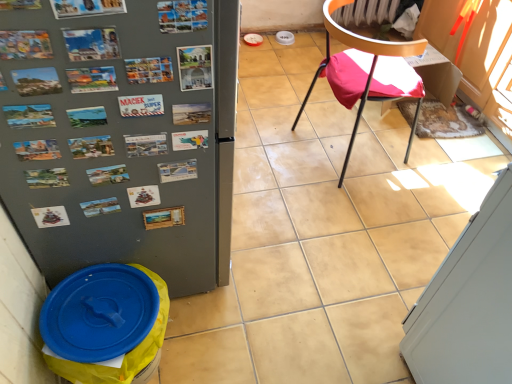
You are a GUI agent. You are given a task and a screenshot of the screen. Output one action in this format:
    pyautogui.click(x=<x>, y=<y>)
    Task: Click on the vacant space positioned to the left of metallic black chair at center right
    The height and width of the screenshot is (384, 512).
    Given the screenshot: What is the action you would take?
    pyautogui.click(x=272, y=154)